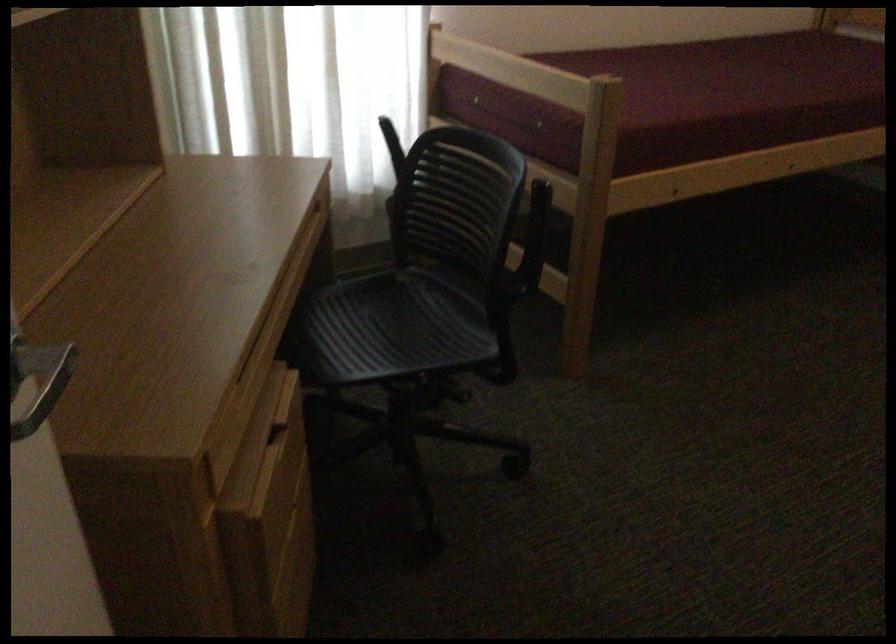
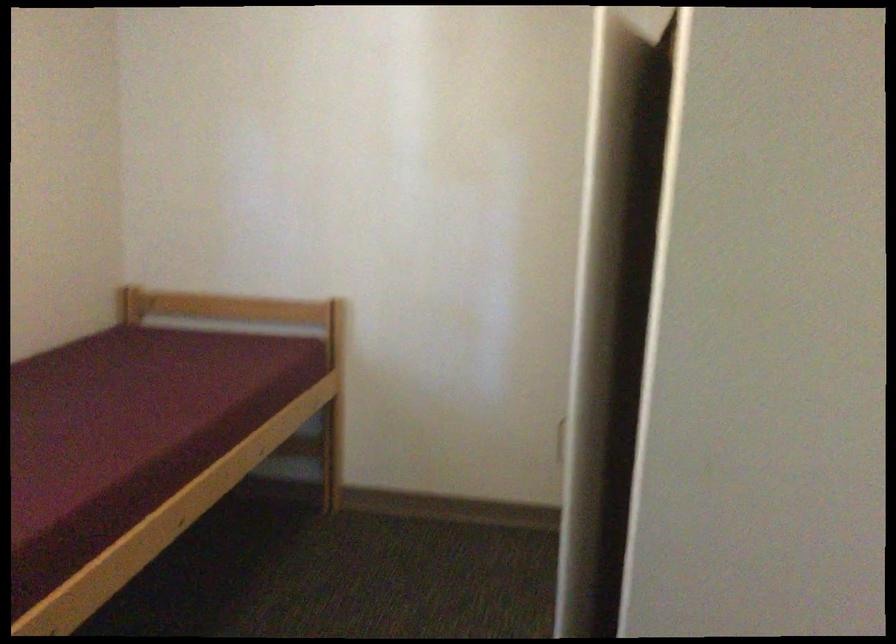
Question: The camera is either moving clockwise (left) or counter-clockwise (right) around the object. The first image is from the beginning of the video and the second image is from the end. Is the camera moving left or right when shooting the video?

Choices:
 (A) Left
 (B) Right

Answer: (A)